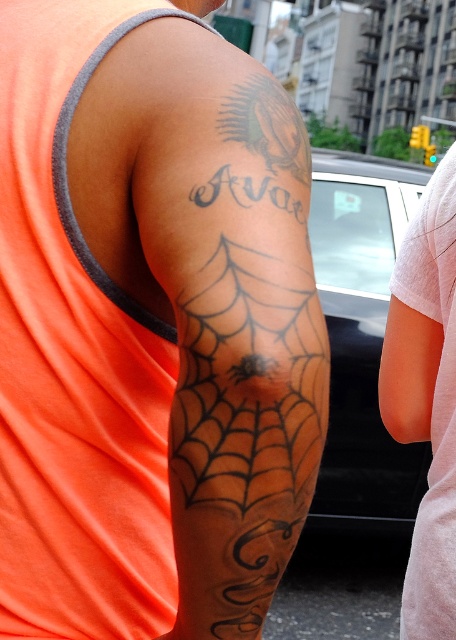
Question: Can you confirm if black ink spiderweb tattoo at upper right is wider than white cotton shirt at right?

Choices:
 (A) no
 (B) yes

Answer: (B)

Question: From the image, what is the correct spatial relationship of black ink spiderweb tattoo at upper right in relation to white cotton shirt at right?

Choices:
 (A) below
 (B) above

Answer: (B)

Question: Can you confirm if black ink spiderweb tattoo at upper right is positioned to the left of white cotton shirt at right?

Choices:
 (A) no
 (B) yes

Answer: (B)

Question: Which object is closer to the camera taking this photo?

Choices:
 (A) white cotton shirt at right
 (B) black ink spiderweb tattoo at upper right

Answer: (B)